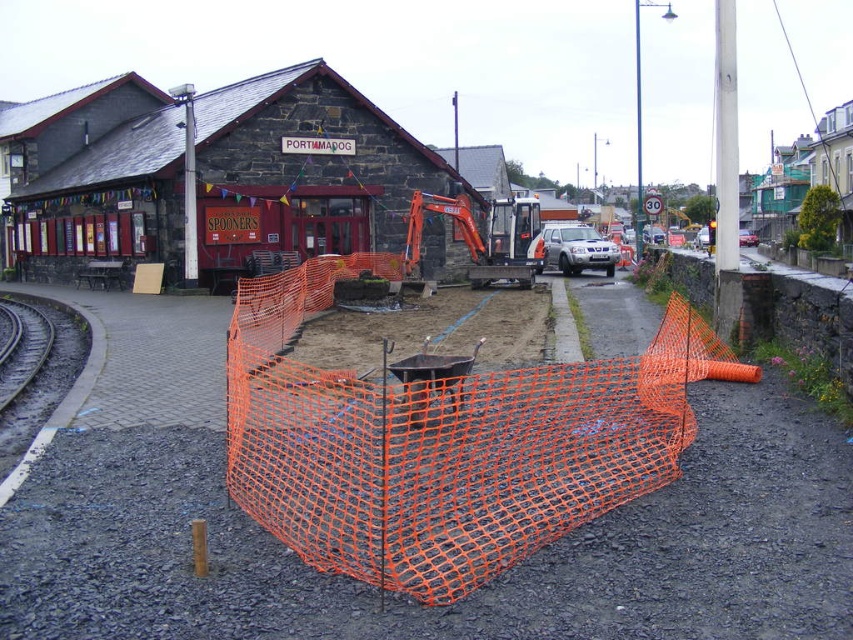
In the scene shown: Is orange mesh fence at center to the right of stone textured building at upper left from the viewer's perspective?

Indeed, orange mesh fence at center is positioned on the right side of stone textured building at upper left.

Who is lower down, orange mesh fence at center or stone textured building at upper left?

Positioned lower is orange mesh fence at center.

The width and height of the screenshot is (853, 640). What do you see at coordinates (444, 442) in the screenshot? I see `orange mesh fence at center` at bounding box center [444, 442].

Identify the location of orange mesh fence at center. The width and height of the screenshot is (853, 640). (444, 442).